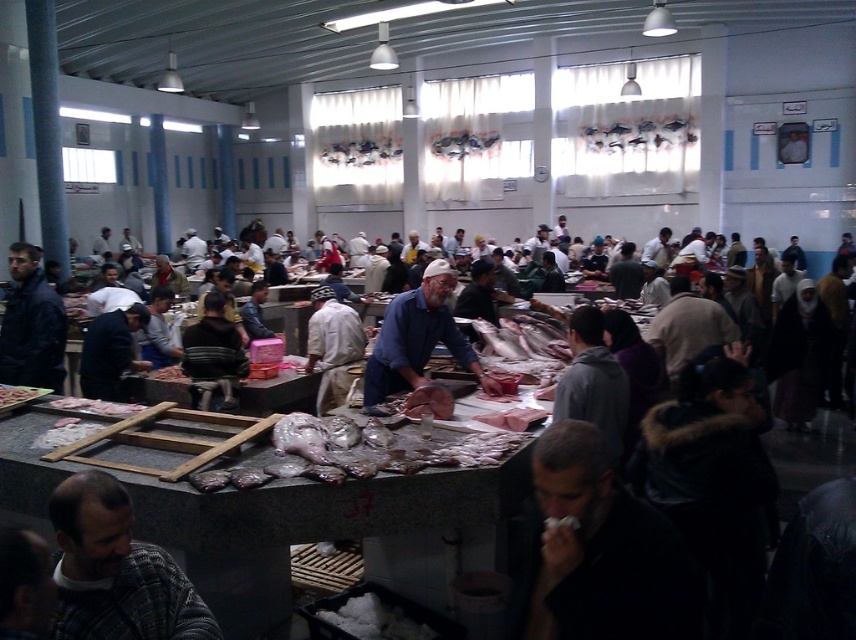
You are standing at the entrance of the fish market and want to locate the dark matte jacket at lower right. According to the coordinates provided, where should you look relative to the center of the image?

The dark matte jacket at lower right is located at coordinates 0.861 on the x axis and 0.704 on the y axis, which means it is positioned to the right and slightly below the center of the image.

You are standing at the entrance of the fish market and want to take a photo of the point at coordinates point (134, 611). If your camera has a maximum focus range of 5 feet, will it be able to focus on that point?

The distance of point (134, 611) from camera is 5.64 feet, which exceeds the camera maximum focus range of 5 feet. Therefore, the camera cannot focus on that point.